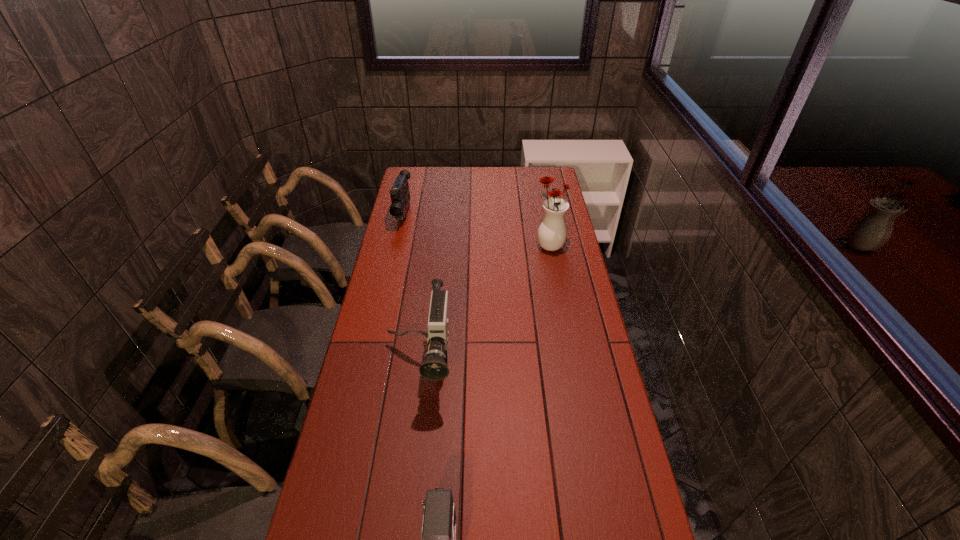
Identify the location of the second farthest object. (552, 231).

Locate an element on the screen. The image size is (960, 540). the rightmost object is located at coordinates (552, 231).

Locate an element on the screen. The height and width of the screenshot is (540, 960). the tallest camcorder is located at coordinates tap(434, 367).

Where is `the third shortest object`? the third shortest object is located at coordinates (434, 367).

Where is `the leftmost camcorder`? the leftmost camcorder is located at coordinates 400,195.

At what (x,y) coordinates should I click in order to perform the action: click on the farthest object. Please return your answer as a coordinate pair (x, y). Looking at the image, I should click on (400, 195).

Find the location of a particular element. This screenshot has width=960, height=540. free region located on the back of the vase is located at coordinates (546, 230).

Where is `free space located on the recording direction of the second farthest camcorder`? free space located on the recording direction of the second farthest camcorder is located at coordinates (401, 515).

Locate an element on the screen. The image size is (960, 540). vacant space located on the front-facing side of the farthest camcorder is located at coordinates (388, 282).

At what (x,y) coordinates should I click in order to perform the action: click on object located at the right edge. Please return your answer as a coordinate pair (x, y). Looking at the image, I should click on (552, 231).